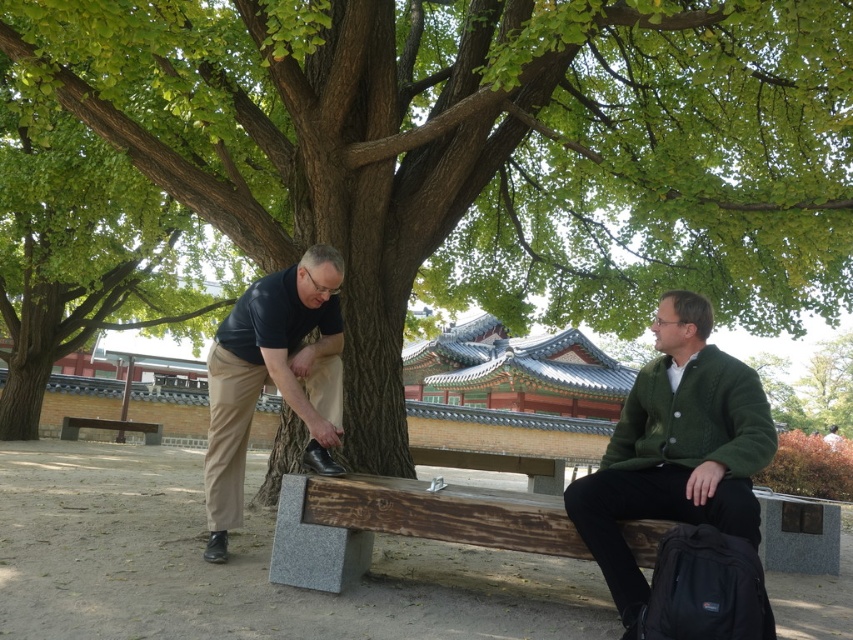
You are standing in the park and see the green leafy tree at upper left and the dark blue shirt at left. Which object is positioned to the left of the other?

The green leafy tree at upper left is to the left of the dark blue shirt at left.

You are planning to sit on the wooden bench at lower left and want to place your green knitted sweater at right nearby. Considering their sizes, which object takes up more space?

The wooden bench at lower left takes up more space than the green knitted sweater at right because the green knitted sweater at right has a smaller size compared to the wooden bench at lower left.